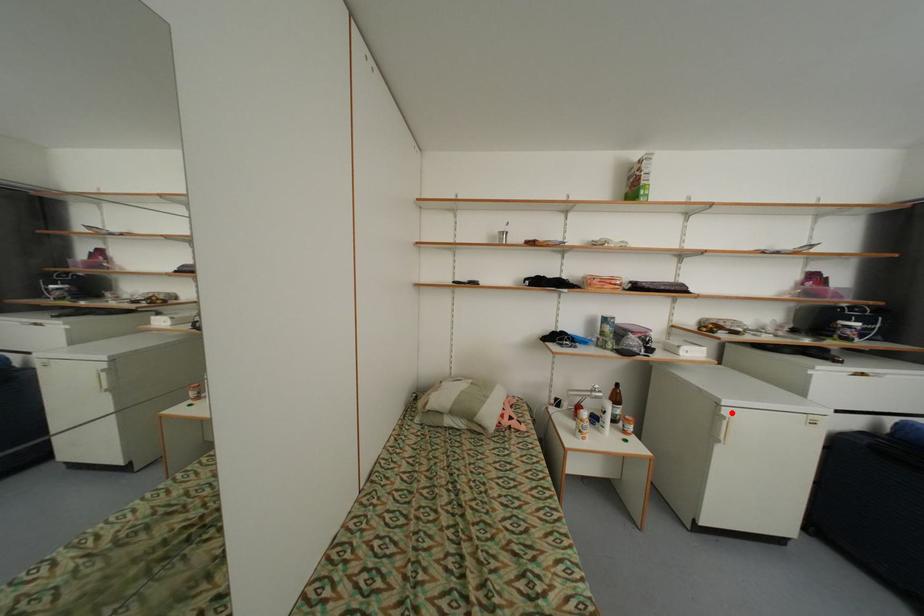
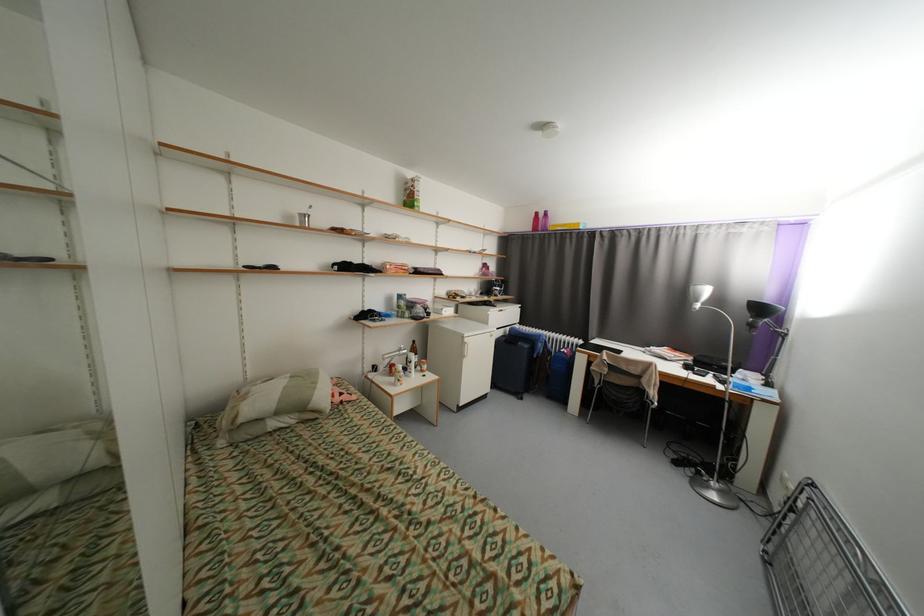
Find the pixel in the second image that matches the highlighted location in the first image.

(472, 341)